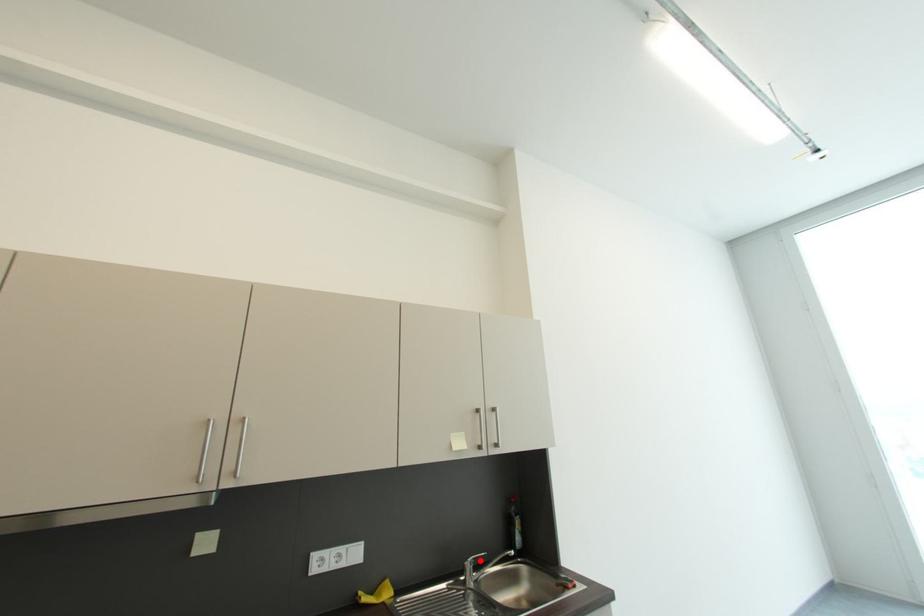
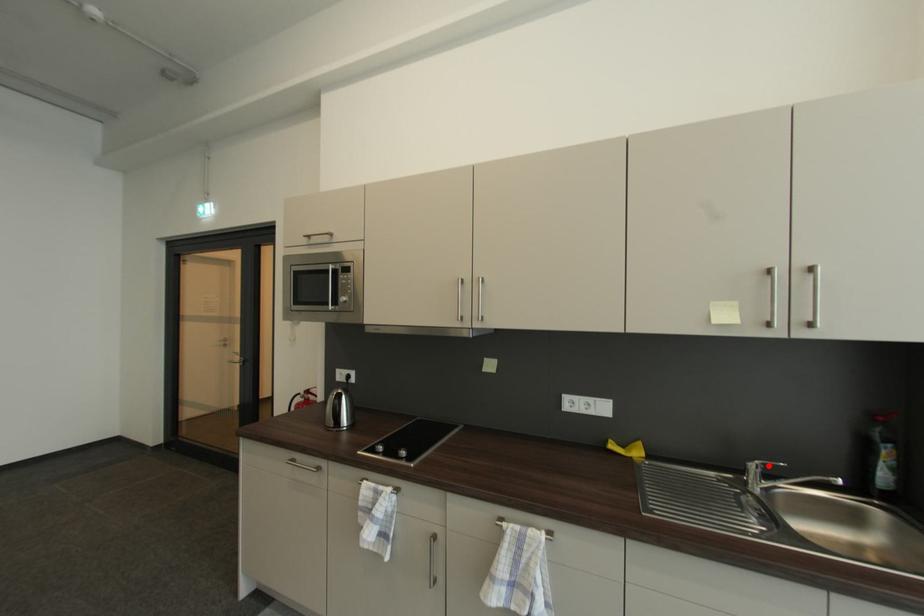
I am providing you with two images of the same scene from different viewpoints. A red point is marked on the first image and another point is marked on the second image. Is the red point in image1 aligned with the point shown in image2?

Yes